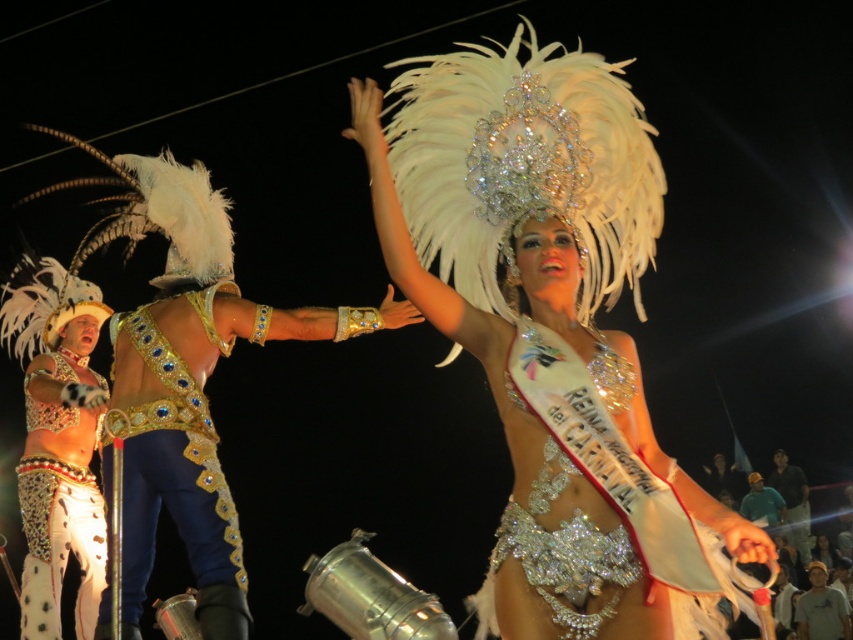
Is white feathered headdress at upper center smaller than white leopard print pants at center?

Incorrect, white feathered headdress at upper center is not smaller in size than white leopard print pants at center.

Is white feathered headdress at upper center further to the viewer compared to white leopard print pants at center?

No, white feathered headdress at upper center is in front of white leopard print pants at center.

Does point (592, 195) come in front of point (83, 520)?

Yes, point (592, 195) is closer to viewer.

Where is `white feathered headdress at upper center`? Image resolution: width=853 pixels, height=640 pixels. white feathered headdress at upper center is located at coordinates (552, 333).

Does white feathered headdress at upper center have a larger size compared to sparkling silver belt at center?

Indeed, white feathered headdress at upper center has a larger size compared to sparkling silver belt at center.

Who is taller, white feathered headdress at upper center or sparkling silver belt at center?

With more height is white feathered headdress at upper center.

At what (x,y) coordinates should I click in order to perform the action: click on white feathered headdress at upper center. Please return your answer as a coordinate pair (x, y). Looking at the image, I should click on (552, 333).

Identify the location of white feathered headdress at upper center. This screenshot has height=640, width=853. (552, 333).

Can you confirm if white leopard print pants at center is positioned to the right of dark blue jeans at center?

No, white leopard print pants at center is not to the right of dark blue jeans at center.

Who is more forward, (78, 637) or (810, 545)?

Positioned in front is point (78, 637).

The image size is (853, 640). I want to click on white leopard print pants at center, so click(x=59, y=516).